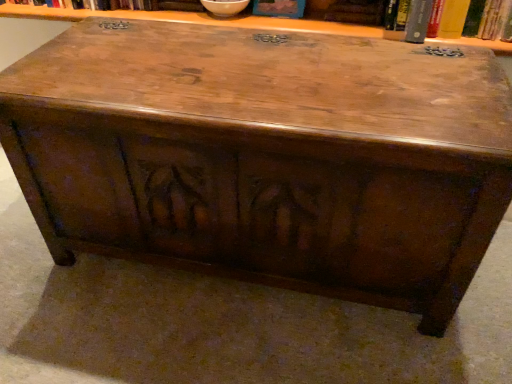
Question: Looking at the image, does hardcover book at upper right, the first book viewed from the right, seem bigger or smaller compared to blue cardboard book at upper center, which is the first book in left-to-right order?

Choices:
 (A) big
 (B) small

Answer: (A)

Question: Based on their positions, is hardcover book at upper right, arranged as the second book when viewed from the left, located to the left or right of blue cardboard book at upper center, which is the 2th book in right-to-left order?

Choices:
 (A) right
 (B) left

Answer: (A)

Question: From their relative heights in the image, would you say hardcover book at upper right, the first book viewed from the right, is taller or shorter than blue cardboard book at upper center, which is the first book in left-to-right order?

Choices:
 (A) tall
 (B) short

Answer: (A)

Question: Do you think blue cardboard book at upper center, which is the 2th book in right-to-left order, is within hardcover book at upper right, arranged as the second book when viewed from the left, or outside of it?

Choices:
 (A) outside
 (B) inside

Answer: (A)

Question: Visually, is blue cardboard book at upper center, which is the first book in left-to-right order, positioned to the left or to the right of hardcover book at upper right, the first book viewed from the right?

Choices:
 (A) left
 (B) right

Answer: (A)

Question: Considering their positions, is blue cardboard book at upper center, which is the 2th book in right-to-left order, located in front of or behind hardcover book at upper right, arranged as the second book when viewed from the left?

Choices:
 (A) front
 (B) behind

Answer: (B)

Question: From the image's perspective, is blue cardboard book at upper center, which is the 2th book in right-to-left order, located above or below hardcover book at upper right, arranged as the second book when viewed from the left?

Choices:
 (A) below
 (B) above

Answer: (B)